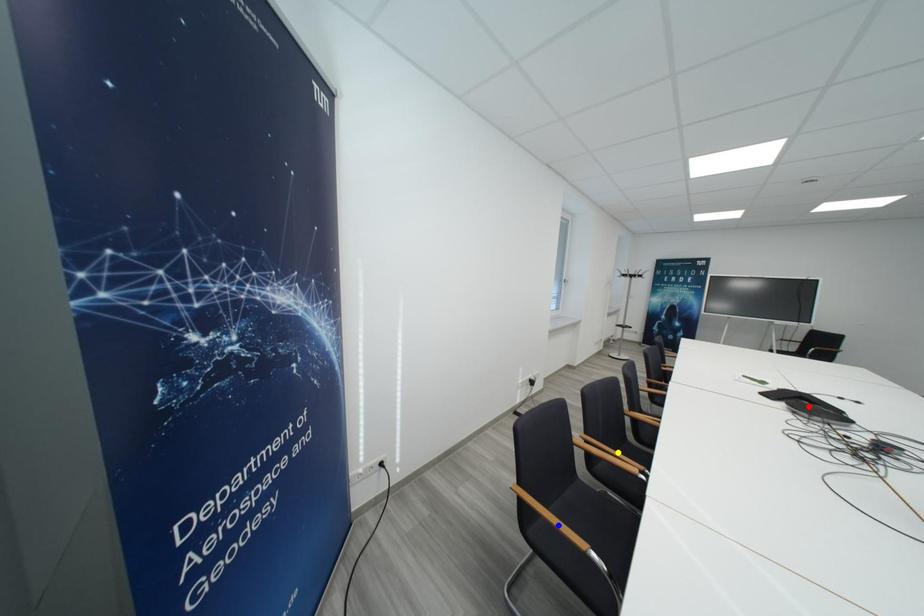
Order these from nearest to farthest:
blue point
yellow point
red point

blue point, red point, yellow point